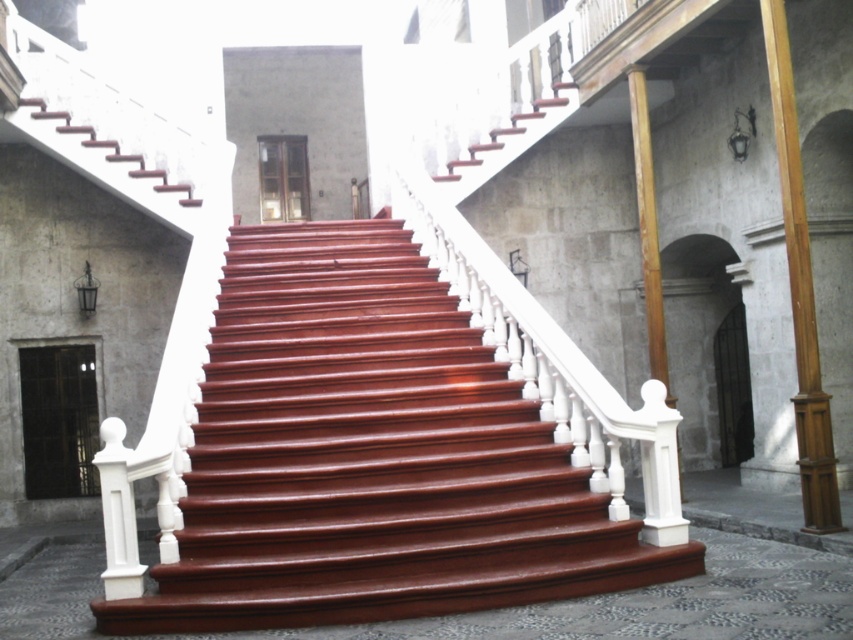
You are standing at the entrance of the staircase and want to reach the shiny wood stairs at center. Which direction should you walk to get there?

You should walk towards the center to reach the shiny wood stairs at center.

You are an interior designer planning to place a decorative sculpture on the staircase. The sculpture requires a flat surface that is to the right of the wooden post at right. Can the shiny wood stairs at center provide such a surface?

The shiny wood stairs at center are to the left of the wooden post at right, so there is no flat surface on the stairs to the right of the wooden post at right. You may need to look for another location.

You are standing at the bottom of the grand staircase in this historic building. You notice a specific point marked at coordinates (x=370, y=456). Based on the scene description, what object does this point most likely correspond to?

The point at (x=370, y=456) corresponds to the shiny wood stairs at center, as indicated in the objects description.